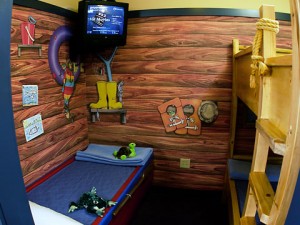
Image resolution: width=300 pixels, height=225 pixels. I want to click on 3 bed in total, so click(x=94, y=170), click(x=243, y=190), click(x=279, y=67).